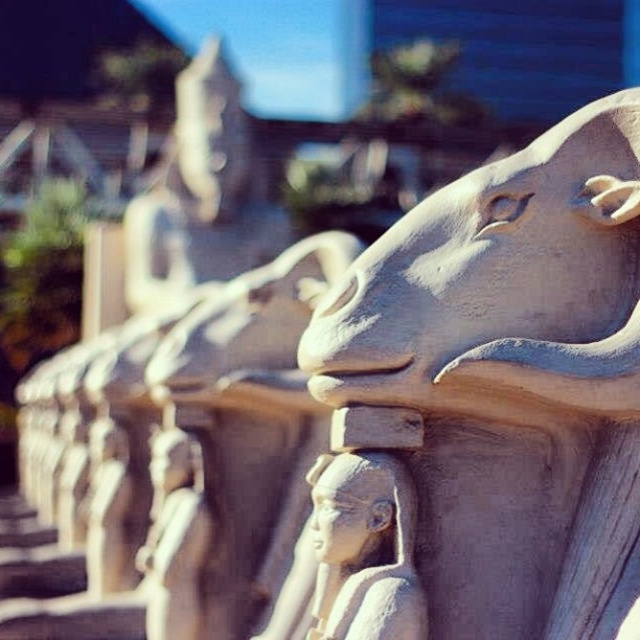
Question: Which of the following is the closest to the observer?

Choices:
 (A) gray stone bull at center
 (B) white stone head at center

Answer: (A)

Question: Observing the image, what is the correct spatial positioning of gray stone bull at center in reference to white stone head at center?

Choices:
 (A) right
 (B) left

Answer: (A)

Question: Is gray stone bull at center closer to the viewer compared to white stone head at center?

Choices:
 (A) no
 (B) yes

Answer: (B)

Question: Does gray stone bull at center appear on the left side of white stone head at center?

Choices:
 (A) yes
 (B) no

Answer: (B)